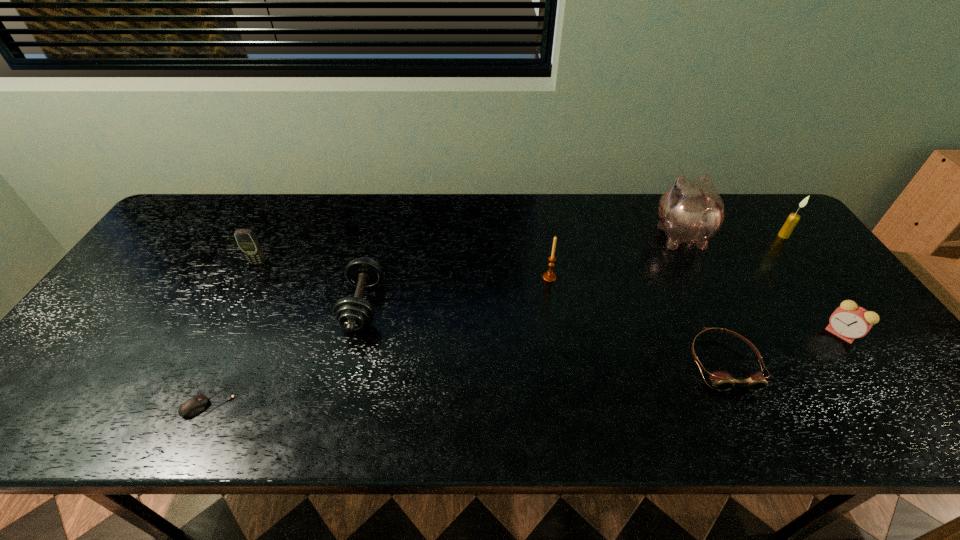
Where is `piggy bank`? piggy bank is located at coordinates (690, 211).

The height and width of the screenshot is (540, 960). What are the coordinates of `candle` in the screenshot? It's located at (792, 220).

In order to click on the fourth object from left to right in this screenshot , I will do `click(549, 276)`.

Identify the location of the fifth shortest object. (247, 241).

Locate an element on the screen. The image size is (960, 540). cellular telephone is located at coordinates (247, 241).

Where is `the sixth object from right to left`? Image resolution: width=960 pixels, height=540 pixels. the sixth object from right to left is located at coordinates (352, 313).

At what (x,y) coordinates should I click in order to perform the action: click on alarm clock. Please return your answer as a coordinate pair (x, y). The width and height of the screenshot is (960, 540). Looking at the image, I should click on (849, 321).

The image size is (960, 540). Find the location of `goggles`. goggles is located at coordinates (721, 380).

Identify the location of mouse. (196, 404).

What are the coordinates of `free region located on the front facing side of the piggy bank` in the screenshot? It's located at (660, 194).